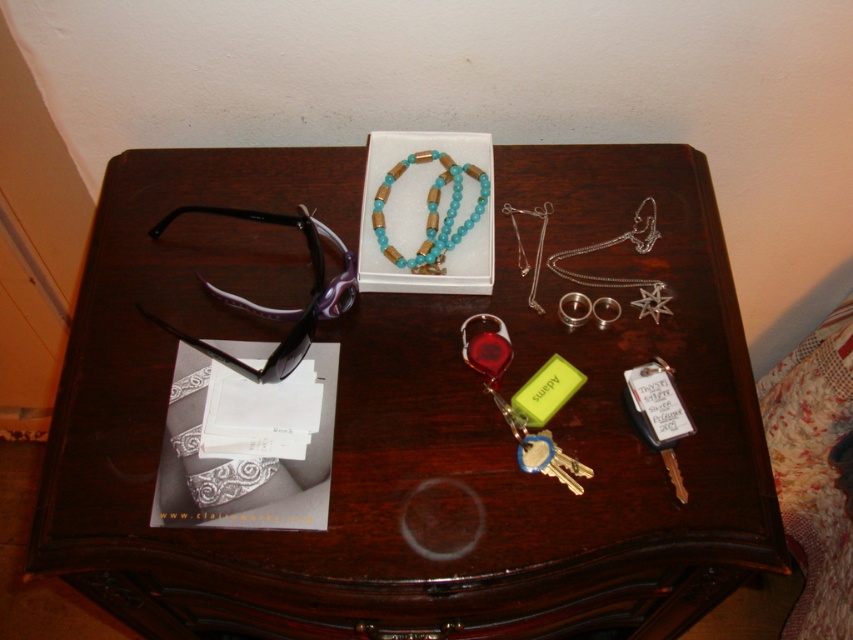
Question: Considering the real-world distances, which object is farthest from the purple plastic sunglasses at left?

Choices:
 (A) translucent plastic keychain at center
 (B) turquoise beads necklace at center
 (C) dark wood table at center

Answer: (C)

Question: Is dark wood table at center smaller than translucent plastic keychain at center?

Choices:
 (A) no
 (B) yes

Answer: (A)

Question: Which point is closer to the camera?

Choices:
 (A) (440, 225)
 (B) (579, 378)

Answer: (B)

Question: Can you confirm if dark wood table at center is positioned to the left of translucent plastic keychain at center?

Choices:
 (A) no
 (B) yes

Answer: (B)

Question: Which of the following is the farthest from the observer?

Choices:
 (A) dark wood table at center
 (B) purple plastic sunglasses at left

Answer: (B)

Question: Considering the relative positions of dark wood table at center and translucent plastic keychain at center in the image provided, where is dark wood table at center located with respect to translucent plastic keychain at center?

Choices:
 (A) above
 (B) below

Answer: (B)